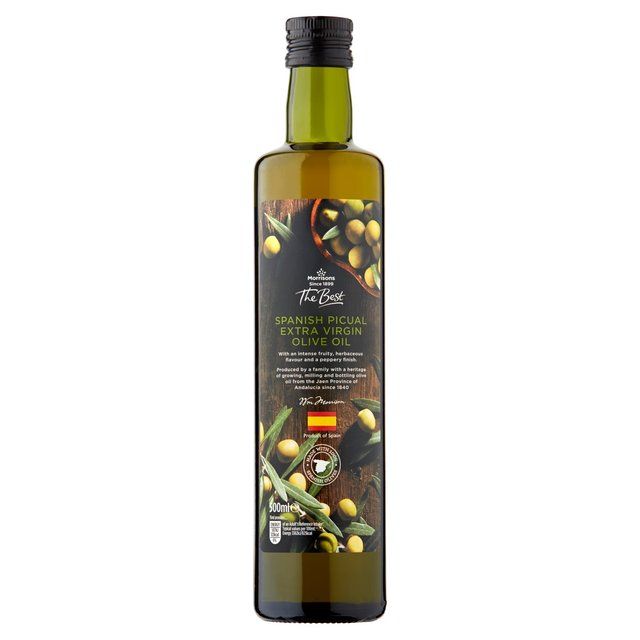
Where is `wooden tabletop`? The image size is (640, 640). wooden tabletop is located at coordinates (272, 387).